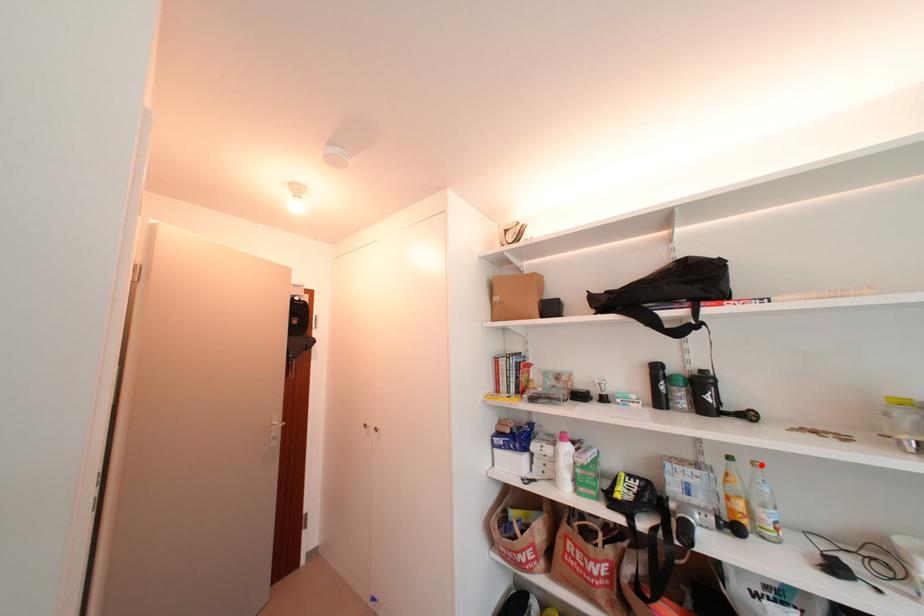
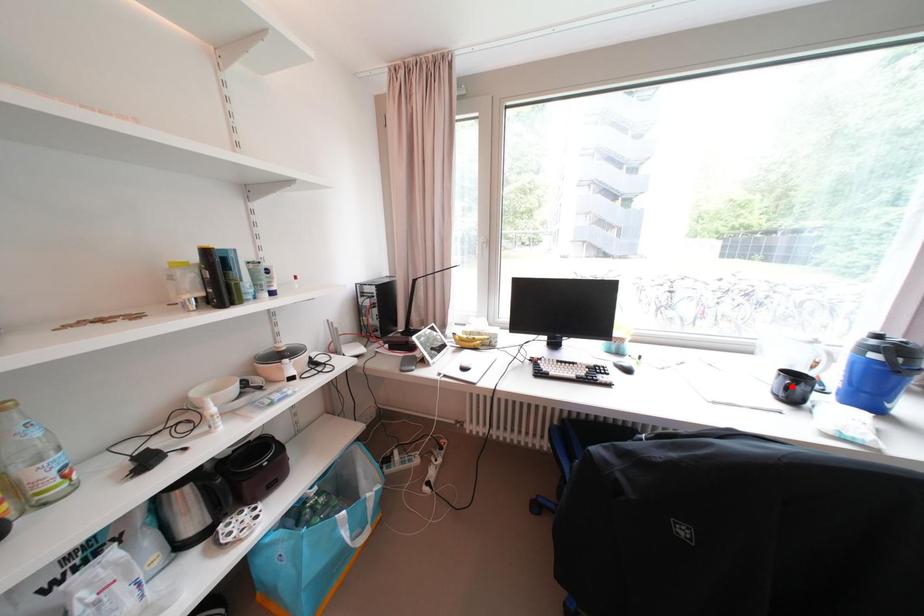
I am providing you with two images of the same scene from different viewpoints. A red point is marked on the first image and another point is marked on the second image. Is the red point in image1 aligned with the point shown in image2?

No